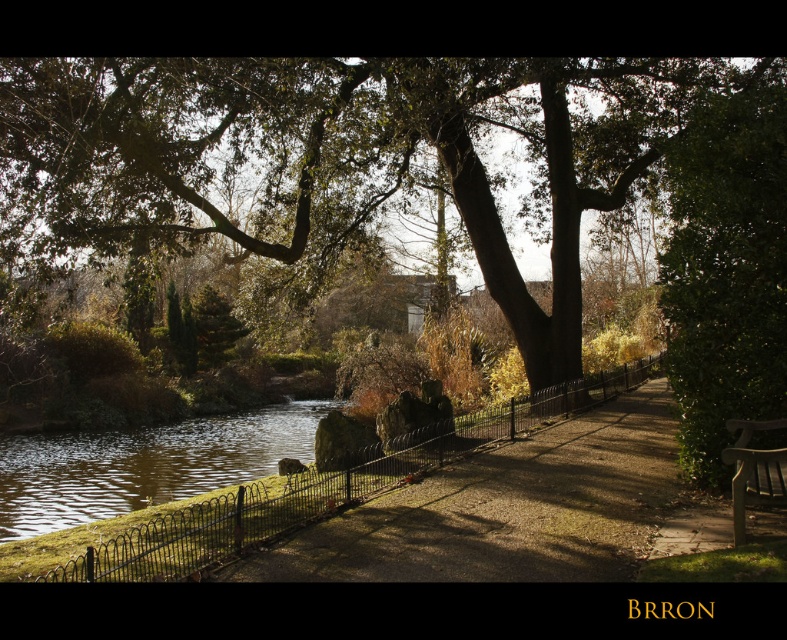
Is green leafy tree at center in front of green mossy rock at lower left?

Yes.

Who is higher up, green leafy tree at center or green mossy rock at lower left?

Positioned higher is green leafy tree at center.

Image resolution: width=787 pixels, height=640 pixels. Identify the location of green leafy tree at center. (338, 156).

You are a GUI agent. You are given a task and a screenshot of the screen. Output one action in this format:
    pyautogui.click(x=<x>, y=<y>)
    Task: Click on the green leafy tree at center
    
    Given the screenshot: What is the action you would take?
    pyautogui.click(x=338, y=156)

Based on the photo, is green leafy tree at center above brown wooden bench at lower right?

Indeed, green leafy tree at center is positioned over brown wooden bench at lower right.

Which is in front, point (228, 176) or point (767, 467)?

Point (767, 467) is more forward.

Between point (113, 132) and point (737, 515), which one is positioned behind?

The point (113, 132) is more distant.

This screenshot has height=640, width=787. In order to click on green leafy tree at center in this screenshot , I will do `click(338, 156)`.

Does green leafy tree at center have a smaller size compared to brown gravel path at center?

Incorrect, green leafy tree at center is not smaller in size than brown gravel path at center.

Locate an element on the screen. This screenshot has height=640, width=787. green leafy tree at center is located at coordinates (338, 156).